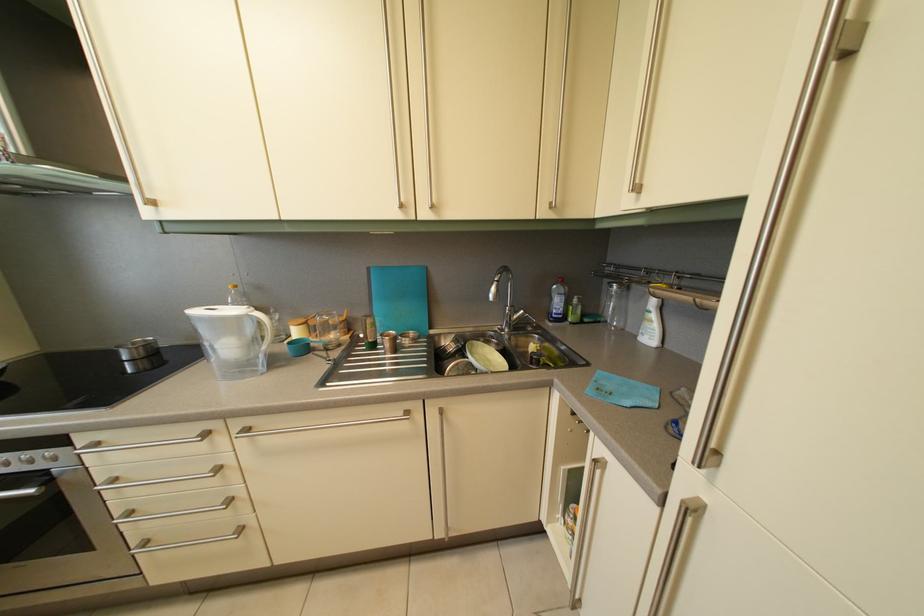
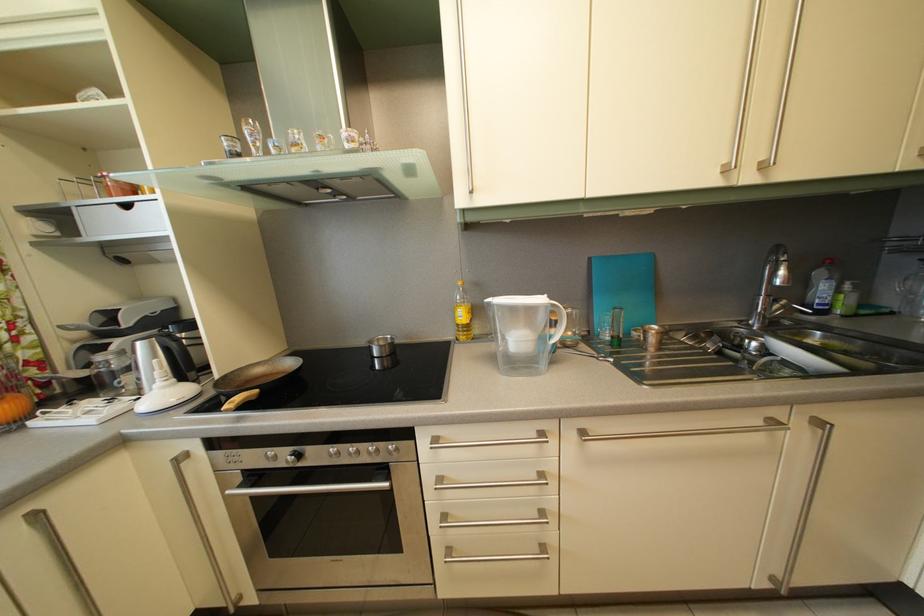
Question: Based on the continuous images, in which direction is the camera rotating? Reply with the corresponding letter.

Choices:
 (A) Left
 (B) Right
 (C) Up
 (D) Down

Answer: (A)